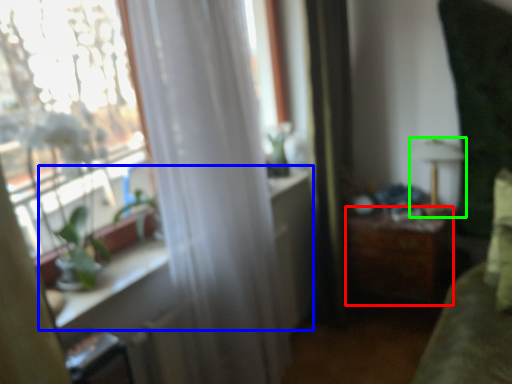
Question: Based on their relative distances, which object is farther from table (highlighted by a red box)? Choose from window sill (highlighted by a blue box) and lamp (highlighted by a green box).

Choices:
 (A) window sill
 (B) lamp

Answer: (A)